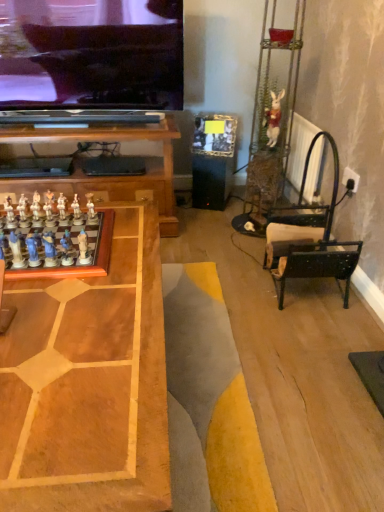
Find the location of a particular element. vacant space to the right of white glossy chess piece at center-left, which is counted as the tenth toy, starting from the left is located at coordinates (125, 258).